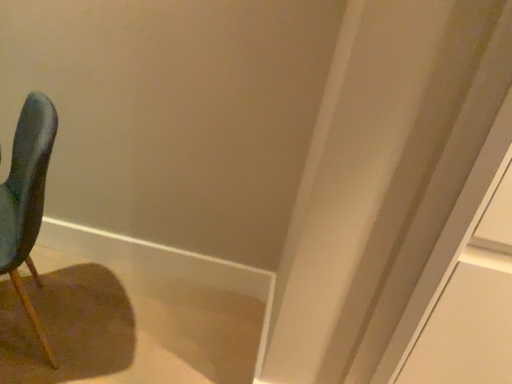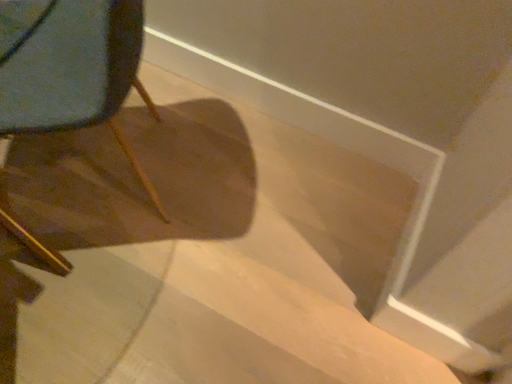
Question: Which way did the camera rotate in the video?

Choices:
 (A) rotated downward
 (B) rotated upward

Answer: (A)